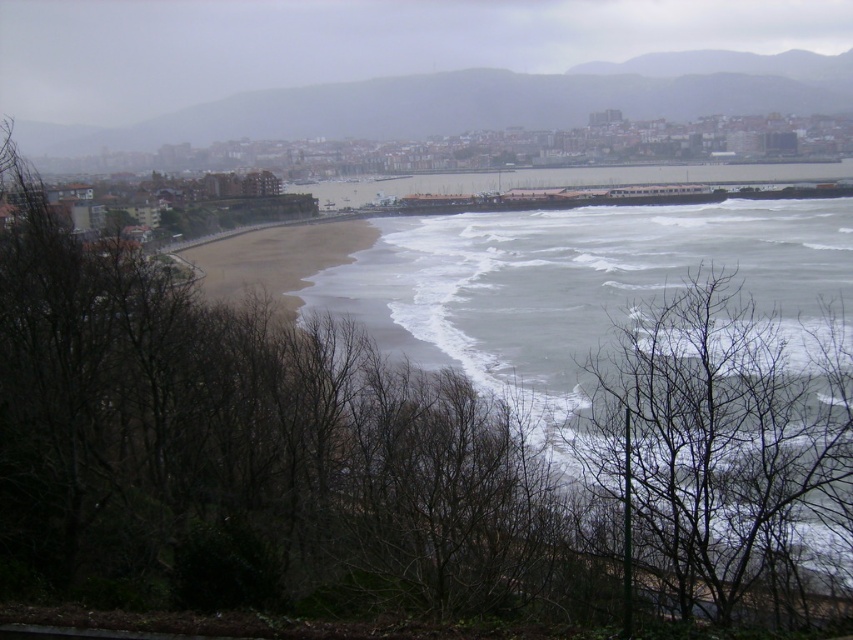
Question: Does gray/foamy water at center have a larger size compared to bare branches at lower right?

Choices:
 (A) yes
 (B) no

Answer: (A)

Question: Does gray/foamy water at center have a larger size compared to bare branches at lower right?

Choices:
 (A) yes
 (B) no

Answer: (A)

Question: Is gray/foamy water at center behind bare branches at lower right?

Choices:
 (A) no
 (B) yes

Answer: (A)

Question: Which of the following is the farthest from the observer?

Choices:
 (A) (830, 397)
 (B) (709, 444)

Answer: (A)

Question: Which object appears farthest from the camera in this image?

Choices:
 (A) bare branches at lower right
 (B) gray/foamy water at center

Answer: (A)